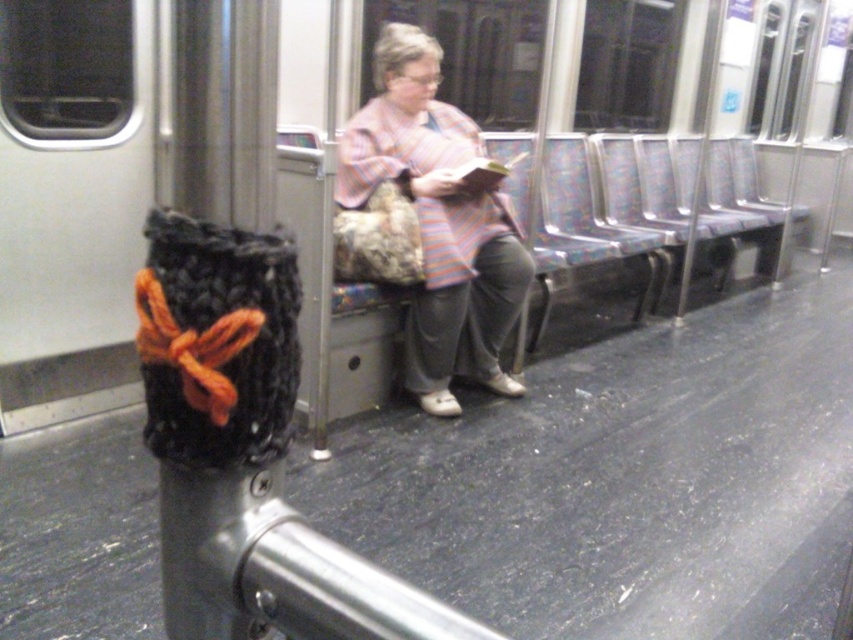
Does black knitted bag at center have a smaller size compared to striped fabric jacket at center?

Correct, black knitted bag at center occupies less space than striped fabric jacket at center.

Who is lower down, black knitted bag at center or striped fabric jacket at center?

striped fabric jacket at center is lower down.

Where is `black knitted bag at center`? The image size is (853, 640). black knitted bag at center is located at coordinates (186, 209).

You are a GUI agent. You are given a task and a screenshot of the screen. Output one action in this format:
    pyautogui.click(x=<x>, y=<y>)
    Task: Click on the black knitted bag at center
    
    Given the screenshot: What is the action you would take?
    pyautogui.click(x=186, y=209)